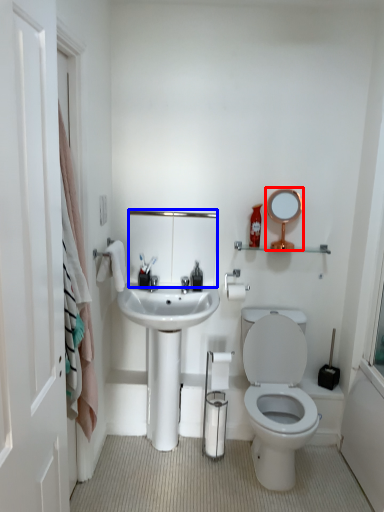
Question: Which object appears closest to the camera in this image, mirror (highlighted by a red box) or mirror (highlighted by a blue box)?

Choices:
 (A) mirror
 (B) mirror

Answer: (A)